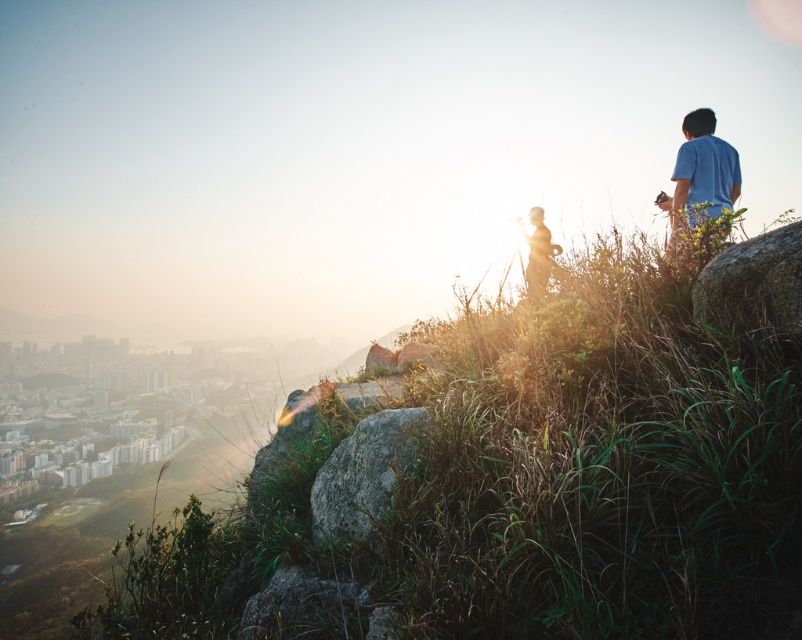
Who is higher up, smooth gray rock at right or silhouette figure at center?

silhouette figure at center

Between point (719, 317) and point (541, 266), which one is positioned in front?

Point (719, 317) is in front.

What do you see at coordinates (752, 285) in the screenshot?
I see `smooth gray rock at right` at bounding box center [752, 285].

Where is `smooth gray rock at right`? This screenshot has height=640, width=802. smooth gray rock at right is located at coordinates (752, 285).

Does gray rough rock at center have a lesser width compared to blue cotton shirt at right?

Yes.

Is point (363, 477) positioned after point (699, 125)?

No, it is not.

Locate an element on the screen. The width and height of the screenshot is (802, 640). gray rough rock at center is located at coordinates (363, 474).

Find the location of `gray rough rock at center`. gray rough rock at center is located at coordinates (363, 474).

Does point (677, 182) lie in front of point (537, 268)?

Yes.

Between point (719, 196) and point (527, 240), which one is positioned behind?

The point (527, 240) is more distant.

Identify the location of blue cotton shirt at right. (703, 168).